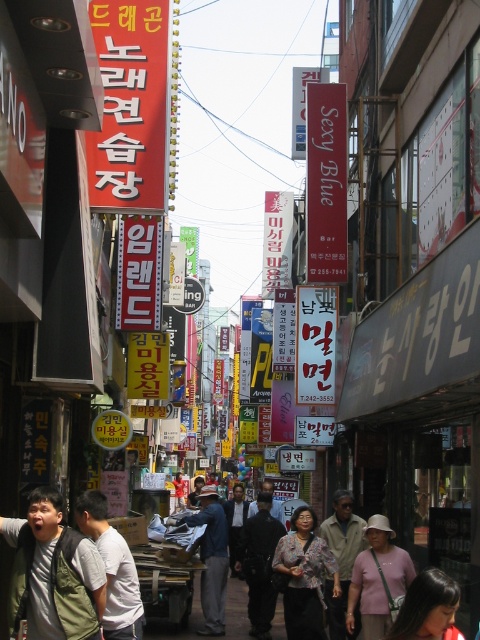
You are standing on the bustling street scene described and want to walk towards the two points marked in the image. Which point, point (332,161) or point (128,218), will you reach first?

Point (332,161) is closer to the viewer than point (128,218), so you will reach point (332,161) first.

You are a pedestrian walking down the street and see the yellow matte sign at center and the dark blue jeans at center. Which object is positioned to the left?

The yellow matte sign at center is to the left of dark blue jeans at center.